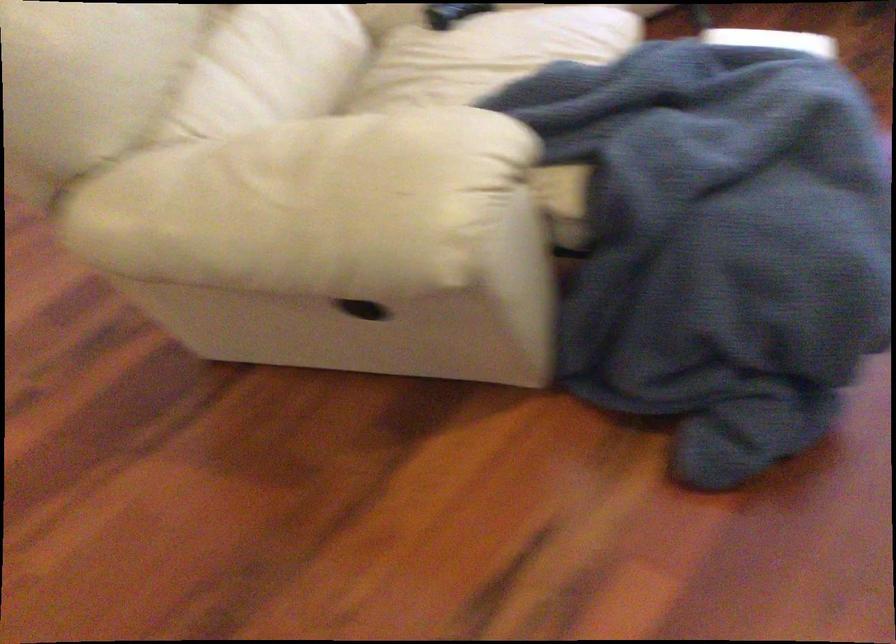
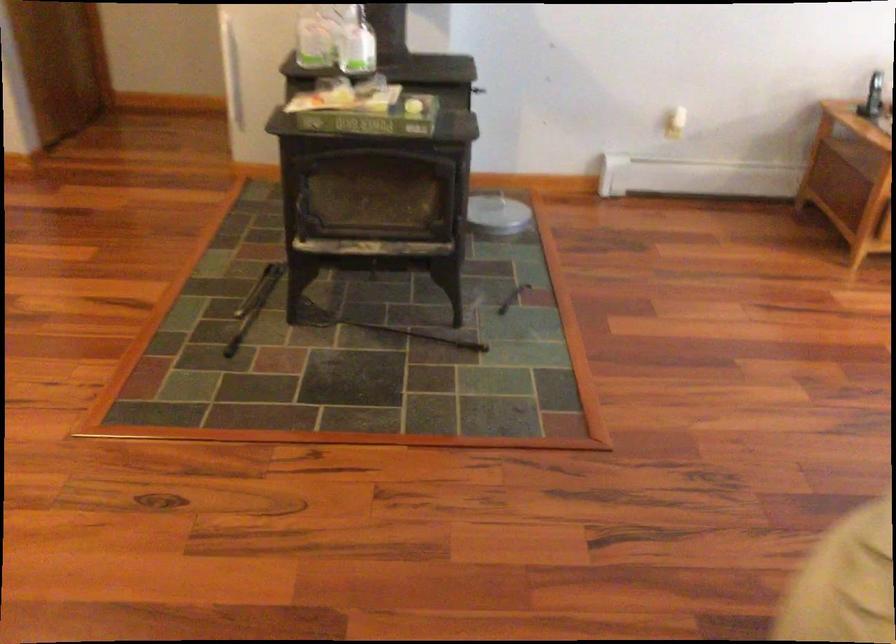
Question: The camera is either moving clockwise (left) or counter-clockwise (right) around the object. The first image is from the beginning of the video and the second image is from the end. Is the camera moving left or right when shooting the video?

Choices:
 (A) Left
 (B) Right

Answer: (B)